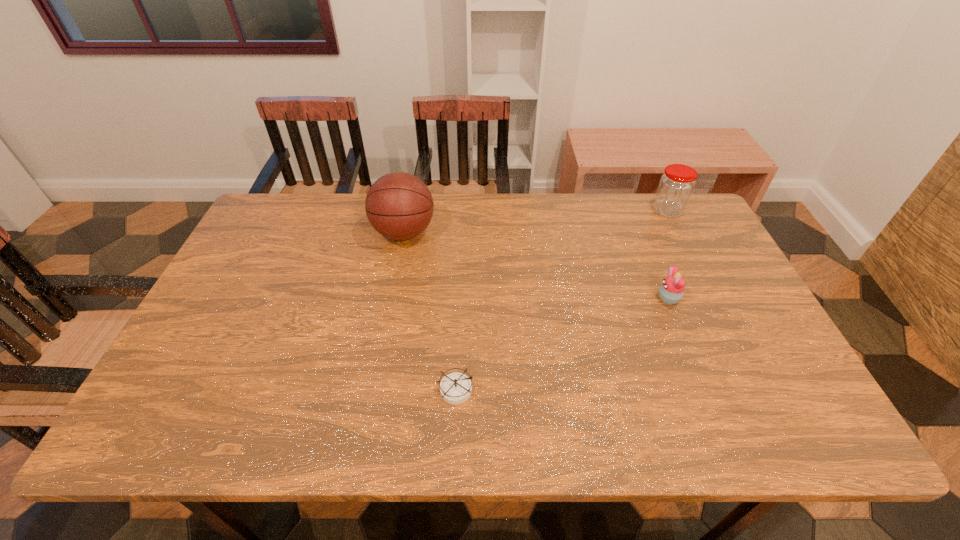
Find the location of a particular element. This screenshot has height=540, width=960. free point located on the face of the third farthest object is located at coordinates (537, 298).

Identify the location of blank area located 0.290m on the face of the third farthest object. (551, 298).

This screenshot has width=960, height=540. I want to click on vacant space located 0.330m on the face of the third farthest object, so click(537, 298).

Identify the location of vacant space located on the front of the shortest object. (453, 435).

Where is `basketball that is positioned at the far edge`? This screenshot has height=540, width=960. basketball that is positioned at the far edge is located at coordinates coord(399,206).

Find the location of a particular element. jar at the far edge is located at coordinates (676, 185).

Find the location of `object located at the near edge`. object located at the near edge is located at coordinates (455, 388).

Find the location of a particular element. The image size is (960, 540). object located in the right edge section of the desktop is located at coordinates (676, 185).

Locate an element on the screen. The height and width of the screenshot is (540, 960). object located in the far right corner section of the desktop is located at coordinates (676, 185).

Find the location of a particular element. free space at the far edge of the desktop is located at coordinates (595, 193).